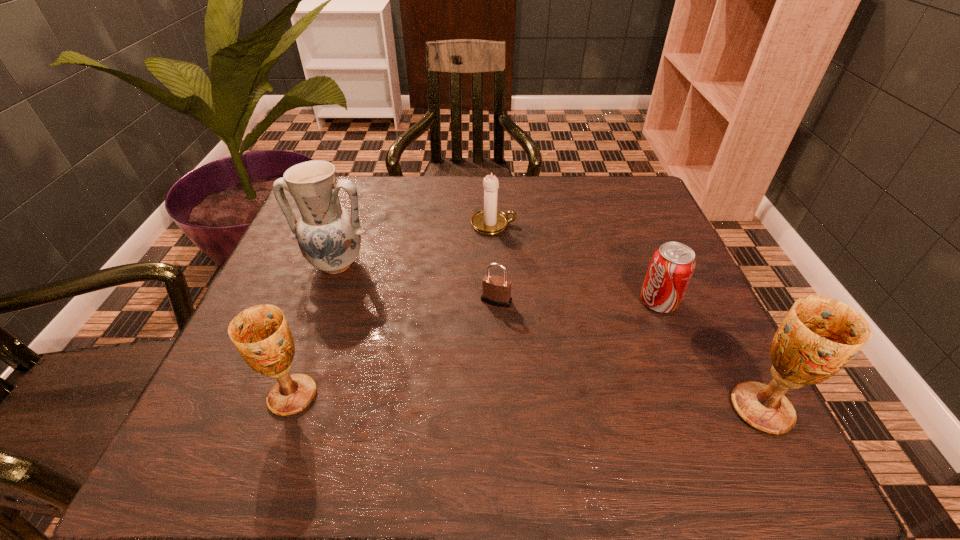
The image size is (960, 540). What are the coordinates of `free space that is in between the padlock and the soda` in the screenshot? It's located at (577, 301).

At what (x,y) coordinates should I click in order to perform the action: click on vacant space that is in between the rightmost object and the farthest object. Please return your answer as a coordinate pair (x, y). This screenshot has height=540, width=960. Looking at the image, I should click on [628, 316].

Where is `vacant point located between the left chalice and the soda`? vacant point located between the left chalice and the soda is located at coordinates (475, 349).

The width and height of the screenshot is (960, 540). In order to click on free space between the left chalice and the shortest object in this screenshot , I will do `click(395, 348)`.

Find the location of a particular element. free space between the left chalice and the fifth object from left to right is located at coordinates (475, 349).

This screenshot has height=540, width=960. What are the coordinates of `vacant space that is in between the soda and the candle holder` in the screenshot? It's located at (576, 263).

Locate which object ranks second in proximity to the shortest object. Please provide its 2D coordinates. Your answer should be formatted as a tuple, i.e. [(x, y)], where the tuple contains the x and y coordinates of a point satisfying the conditions above.

[(329, 237)]

Identify the location of object that can be found as the second closest to the soda. (496, 290).

Where is `vacant area in the image that satisfies the following two spatial constraints: 1. on the handle side of the farthest object; 2. on the back side of the taller chalice`? vacant area in the image that satisfies the following two spatial constraints: 1. on the handle side of the farthest object; 2. on the back side of the taller chalice is located at coordinates 500,409.

Find the location of `free space that satisfies the following two spatial constraints: 1. on either side of the soda; 2. on the left side of the pottery`. free space that satisfies the following two spatial constraints: 1. on either side of the soda; 2. on the left side of the pottery is located at coordinates (323, 302).